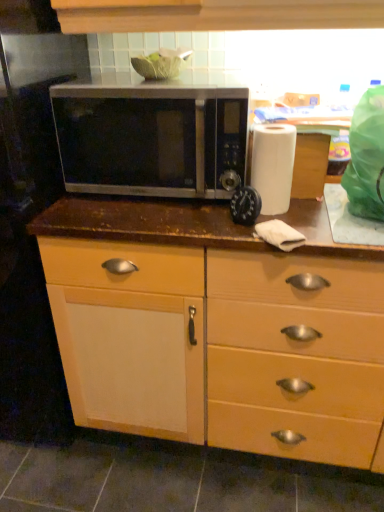
Question: Would you say satin silver microwave at center is outside matte wood cabinet at center?

Choices:
 (A) no
 (B) yes

Answer: (B)

Question: From the image's perspective, is satin silver microwave at center on matte wood cabinet at center?

Choices:
 (A) yes
 (B) no

Answer: (A)

Question: Considering the relative sizes of satin silver microwave at center and matte wood cabinet at center in the image provided, is satin silver microwave at center thinner than matte wood cabinet at center?

Choices:
 (A) yes
 (B) no

Answer: (A)

Question: Could you tell me if satin silver microwave at center is turned towards matte wood cabinet at center?

Choices:
 (A) no
 (B) yes

Answer: (A)

Question: Does satin silver microwave at center have a smaller size compared to matte wood cabinet at center?

Choices:
 (A) no
 (B) yes

Answer: (B)

Question: Is satin silver microwave at center closer to camera compared to matte wood cabinet at center?

Choices:
 (A) yes
 (B) no

Answer: (B)

Question: Could white matte paper towel at right be considered to be inside black plastic timer at center?

Choices:
 (A) yes
 (B) no

Answer: (B)

Question: Could you tell me if black plastic timer at center is facing white matte paper towel at right?

Choices:
 (A) no
 (B) yes

Answer: (A)

Question: Is black plastic timer at center positioned beyond the bounds of white matte paper towel at right?

Choices:
 (A) no
 (B) yes

Answer: (B)

Question: Is black plastic timer at center positioned in front of white matte paper towel at right?

Choices:
 (A) yes
 (B) no

Answer: (A)

Question: Can you confirm if black plastic timer at center is thinner than white matte paper towel at right?

Choices:
 (A) yes
 (B) no

Answer: (A)

Question: From a real-world perspective, is black plastic timer at center located higher than white matte paper towel at right?

Choices:
 (A) no
 (B) yes

Answer: (A)

Question: Does matte wood cabinet at center have a greater width compared to black plastic timer at center?

Choices:
 (A) yes
 (B) no

Answer: (A)